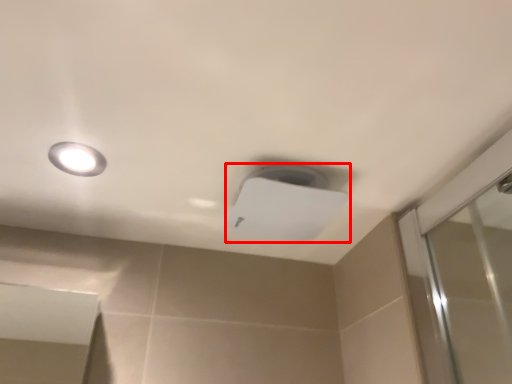
Question: From the image's perspective, where is lamp (annotated by the red box) located relative to droplight?

Choices:
 (A) above
 (B) below

Answer: (B)